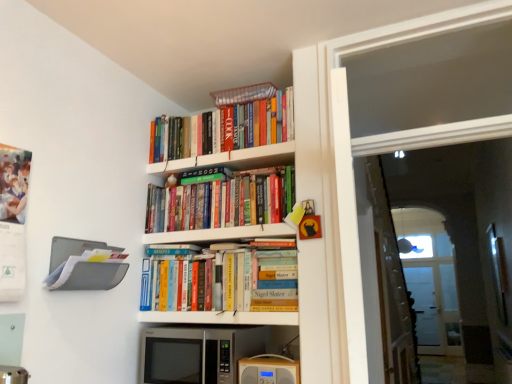
Question: Does hardcover books at center, the fourth shelf when ordered from top to bottom, lie behind transparent glass door at upper right?

Choices:
 (A) no
 (B) yes

Answer: (B)

Question: Can you confirm if hardcover books at center, positioned as the 1th shelf in bottom-to-top order, is wider than transparent glass door at upper right?

Choices:
 (A) yes
 (B) no

Answer: (A)

Question: Can you confirm if hardcover books at center, positioned as the 1th shelf in bottom-to-top order, is positioned to the left of transparent glass door at upper right?

Choices:
 (A) yes
 (B) no

Answer: (A)

Question: Considering the relative sizes of hardcover books at center, positioned as the 1th shelf in bottom-to-top order, and transparent glass door at upper right in the image provided, is hardcover books at center, positioned as the 1th shelf in bottom-to-top order, smaller than transparent glass door at upper right?

Choices:
 (A) yes
 (B) no

Answer: (A)

Question: Is transparent glass door at upper right surrounded by hardcover books at center, the fourth shelf when ordered from top to bottom?

Choices:
 (A) yes
 (B) no

Answer: (B)

Question: Does point (337, 317) appear closer or farther from the camera than point (211, 139)?

Choices:
 (A) closer
 (B) farther

Answer: (A)

Question: In terms of height, does transparent glass door at upper right look taller or shorter compared to hardcover books at upper center, placed as the third book when sorted from bottom to top?

Choices:
 (A) short
 (B) tall

Answer: (B)

Question: From the image's perspective, is transparent glass door at upper right positioned above or below hardcover books at upper center, placed as the third book when sorted from bottom to top?

Choices:
 (A) below
 (B) above

Answer: (A)

Question: From a real-world perspective, is transparent glass door at upper right above or below hardcover books at upper center, the 1th book when ordered from top to bottom?

Choices:
 (A) above
 (B) below

Answer: (B)

Question: Which is correct: transparent plastic screen door at right is inside hardcover books at upper center, positioned as the second book in bottom-to-top order, or outside of it?

Choices:
 (A) outside
 (B) inside

Answer: (A)

Question: Based on their sizes in the image, would you say transparent plastic screen door at right is bigger or smaller than hardcover books at upper center, the 2th book when ordered from top to bottom?

Choices:
 (A) small
 (B) big

Answer: (B)

Question: Considering the positions of transparent plastic screen door at right and hardcover books at upper center, positioned as the second book in bottom-to-top order, in the image, is transparent plastic screen door at right taller or shorter than hardcover books at upper center, positioned as the second book in bottom-to-top order,?

Choices:
 (A) tall
 (B) short

Answer: (A)

Question: From the image's perspective, relative to hardcover books at upper center, positioned as the second book in bottom-to-top order, is transparent plastic screen door at right above or below?

Choices:
 (A) above
 (B) below

Answer: (B)

Question: In terms of width, does hardcover books at upper center, the 1th book when ordered from top to bottom, look wider or thinner when compared to transparent plastic screen door at right?

Choices:
 (A) thin
 (B) wide

Answer: (B)

Question: In the image, is hardcover books at upper center, the 1th book when ordered from top to bottom, positioned in front of or behind transparent plastic screen door at right?

Choices:
 (A) behind
 (B) front

Answer: (B)